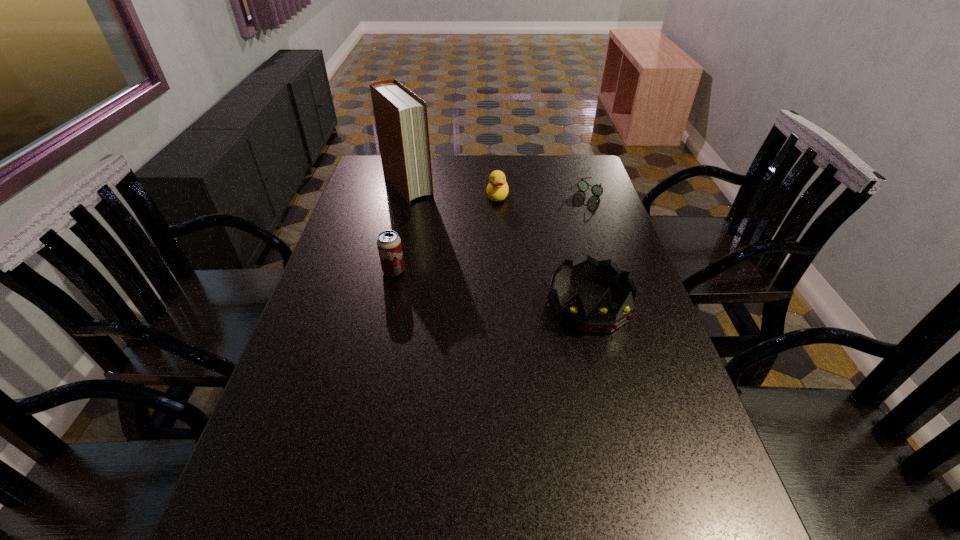
This screenshot has width=960, height=540. In order to click on unoccupied area between the third object from right to left and the tiara in this screenshot , I will do `click(543, 251)`.

At what (x,y) coordinates should I click in order to perform the action: click on free space between the fourth shortest object and the beer can. Please return your answer as a coordinate pair (x, y). The height and width of the screenshot is (540, 960). Looking at the image, I should click on (492, 288).

I want to click on free point between the spectacles and the beer can, so click(x=488, y=234).

You are a GUI agent. You are given a task and a screenshot of the screen. Output one action in this format:
    pyautogui.click(x=<x>, y=<y>)
    Task: Click on the free point between the tallest object and the third shortest object
    
    Given the screenshot: What is the action you would take?
    pyautogui.click(x=400, y=228)

Locate an element on the screen. free spot between the tallest object and the third shortest object is located at coordinates (400, 228).

Image resolution: width=960 pixels, height=540 pixels. I want to click on vacant space that is in between the third object from right to left and the spectacles, so click(540, 197).

At what (x,y) coordinates should I click in order to perform the action: click on free spot between the third shortest object and the fourth shortest object. Please return your answer as a coordinate pair (x, y). The image size is (960, 540). Looking at the image, I should click on (492, 288).

Identify the location of object that is the second closest to the duckling. (597, 190).

Find the location of a particular element. object identified as the third closest to the spectacles is located at coordinates (401, 118).

Locate an element on the screen. This screenshot has height=540, width=960. vacant region that satisfies the following two spatial constraints: 1. on the back side of the third shortest object; 2. on the left side of the spectacles is located at coordinates (410, 198).